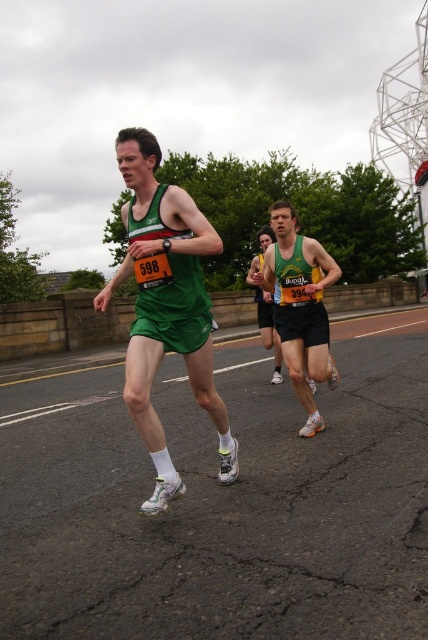
Question: Is green fabric tank top at center to the left of green fabric running outfit at center from the viewer's perspective?

Choices:
 (A) no
 (B) yes

Answer: (B)

Question: Which point is farther from the camera taking this photo?

Choices:
 (A) (151, 268)
 (B) (309, 349)

Answer: (B)

Question: Which of the following is the farthest from the observer?

Choices:
 (A) green fabric tank top at center
 (B) green fabric running outfit at center

Answer: (B)

Question: From the image, what is the correct spatial relationship of green fabric tank top at center in relation to green fabric running outfit at center?

Choices:
 (A) right
 (B) left

Answer: (B)

Question: Can you confirm if green fabric tank top at center is positioned above green fabric running outfit at center?

Choices:
 (A) no
 (B) yes

Answer: (B)